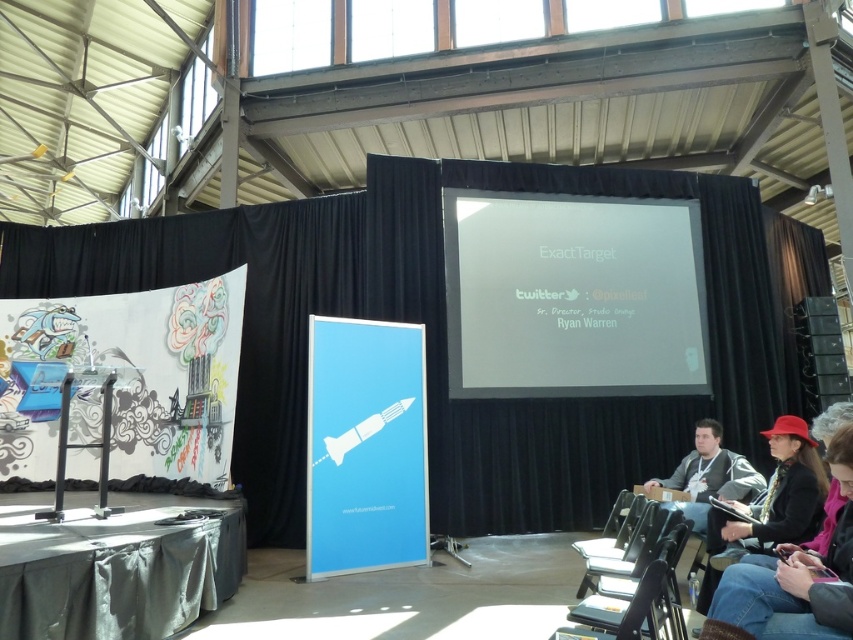
Question: Among these objects, which one is farthest from the camera?

Choices:
 (A) black matte curtain at center
 (B) metallic silver chair at lower right

Answer: (A)

Question: Which point appears farthest from the camera in this image?

Choices:
 (A) (659, 596)
 (B) (247, 216)
 (C) (321, 572)

Answer: (B)

Question: Does white matte projector screen at center lie in front of metallic silver chair at lower right?

Choices:
 (A) no
 (B) yes

Answer: (A)

Question: Where is white matte projector screen at center located in relation to blue paper rocket at center in the image?

Choices:
 (A) right
 (B) left

Answer: (A)

Question: Is blue paper rocket at center to the right of metallic silver chair at lower right from the viewer's perspective?

Choices:
 (A) yes
 (B) no

Answer: (B)

Question: Estimate the real-world distances between objects in this image. Which object is farther from the black leather jacket at lower right?

Choices:
 (A) black matte curtain at center
 (B) metallic silver chair at lower right
 (C) white matte projector screen at center
 (D) blue paper rocket at center

Answer: (A)